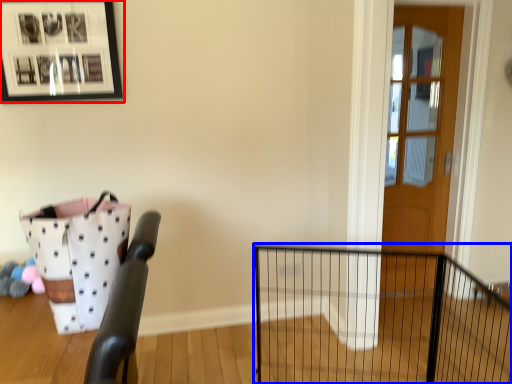
Question: Which point is closer to the camera, picture frame (highlighted by a red box) or fence (highlighted by a blue box)?

Choices:
 (A) picture frame
 (B) fence

Answer: (B)